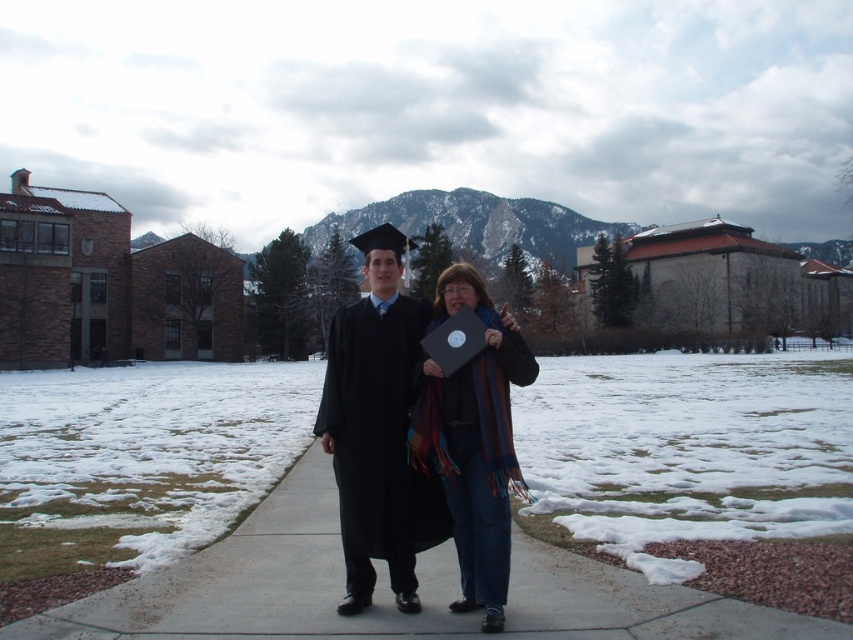
Question: Among these objects, which one is nearest to the camera?

Choices:
 (A) concrete at center
 (B) matte black graduation gown at center
 (C) blue striped scarf at center

Answer: (A)

Question: Does black matte graduation gown at center have a larger size compared to blue striped scarf at center?

Choices:
 (A) yes
 (B) no

Answer: (B)

Question: Can you confirm if black matte graduation gown at center is positioned above blue striped scarf at center?

Choices:
 (A) no
 (B) yes

Answer: (A)

Question: Can you confirm if matte black graduation gown at center is wider than blue striped scarf at center?

Choices:
 (A) no
 (B) yes

Answer: (B)

Question: Which point is closer to the camera?

Choices:
 (A) blue striped scarf at center
 (B) concrete at center
 (C) black matte graduation gown at center

Answer: (B)

Question: Which point is closer to the camera?

Choices:
 (A) matte black graduation gown at center
 (B) blue striped scarf at center

Answer: (B)